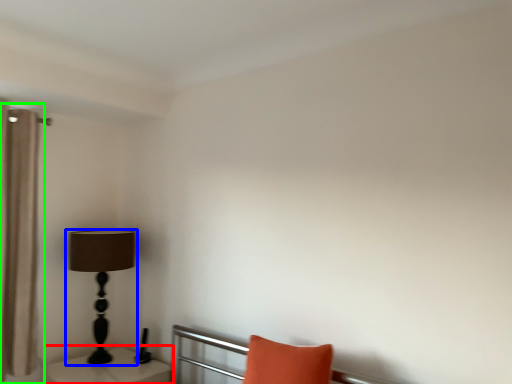
Question: Estimate the real-world distances between objects in this image. Which object is closer to table (highlighted by a red box), lamp (highlighted by a blue box) or curtain (highlighted by a green box)?

Choices:
 (A) lamp
 (B) curtain

Answer: (A)